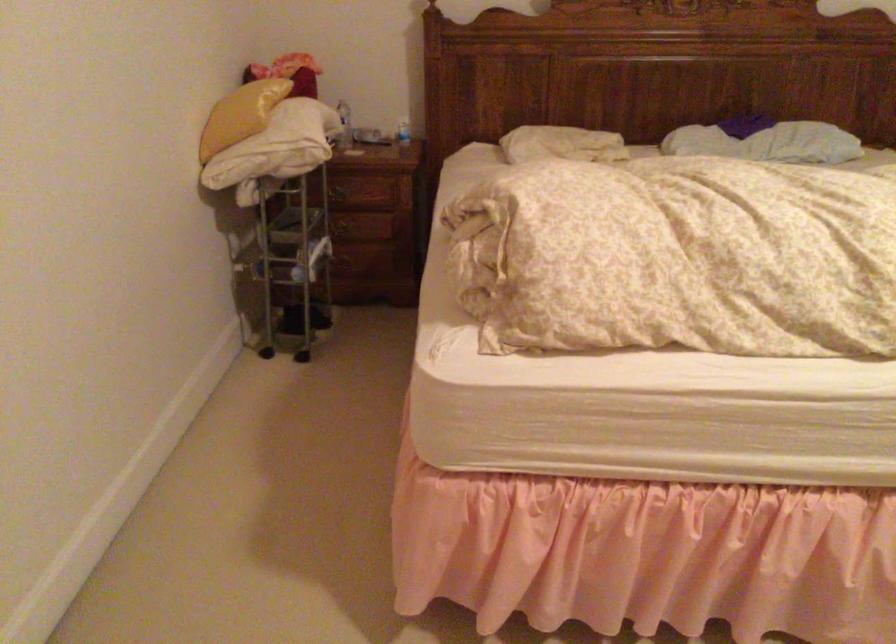
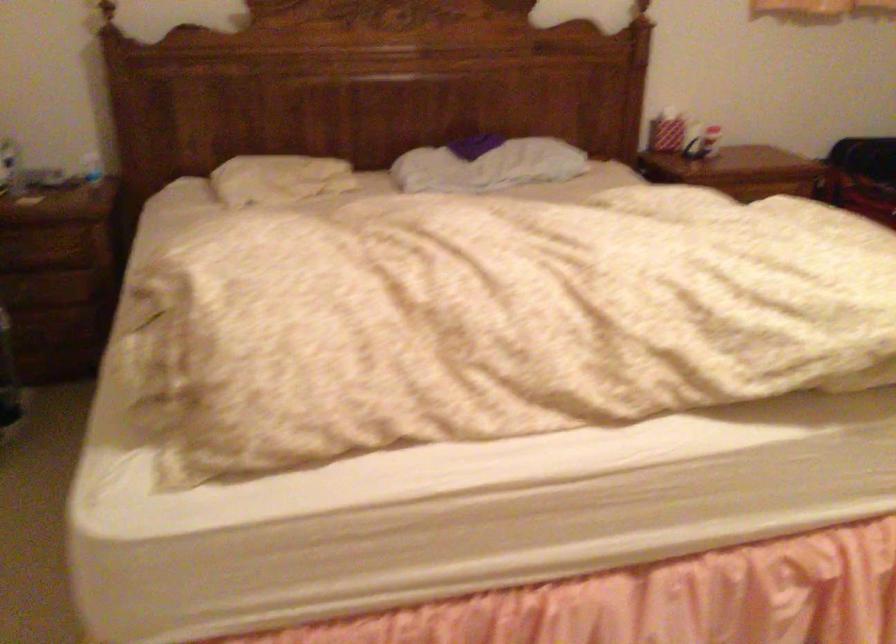
The images are taken continuously from a first-person perspective. In which direction are you moving?

The cameraman walked toward right, forward.